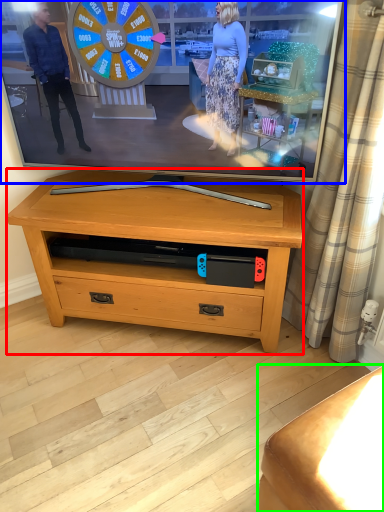
Question: Considering the real-world distances, which object is farthest from table (highlighted by a red box)? television (highlighted by a blue box) or furniture (highlighted by a green box)?

Choices:
 (A) television
 (B) furniture

Answer: (B)